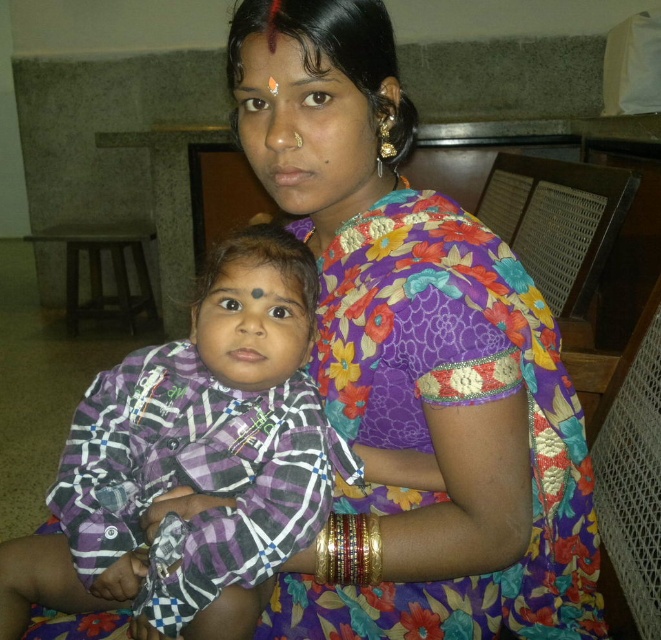
Who is shorter, floral silk saree at center or matte black forehead at upper center?

matte black forehead at upper center is shorter.

Does point (490, 262) come in front of point (276, 38)?

No, (490, 262) is further to viewer.

Does point (379, 131) come closer to viewer compared to point (321, 42)?

No.

Where is `floral silk saree at center`? Image resolution: width=661 pixels, height=640 pixels. floral silk saree at center is located at coordinates (420, 358).

Can you confirm if floral silk saree at center is shorter than purple checkered shirt at center?

No.

Can you confirm if floral silk saree at center is smaller than purple checkered shirt at center?

No.

You are a GUI agent. You are given a task and a screenshot of the screen. Output one action in this format:
    pyautogui.click(x=<x>, y=<y>)
    Task: Click on the floral silk saree at center
    
    Given the screenshot: What is the action you would take?
    pyautogui.click(x=420, y=358)

Between purple checkered shirt at center and matte black forehead at upper center, which one appears on the right side from the viewer's perspective?

matte black forehead at upper center is more to the right.

Consider the image. Does purple checkered shirt at center appear over matte black forehead at upper center?

Actually, purple checkered shirt at center is below matte black forehead at upper center.

Is point (102, 573) positioned before point (268, 38)?

No.

You are a GUI agent. You are given a task and a screenshot of the screen. Output one action in this format:
    pyautogui.click(x=<x>, y=<y>)
    Task: Click on the purple checkered shirt at center
    
    Given the screenshot: What is the action you would take?
    pyautogui.click(x=194, y=456)